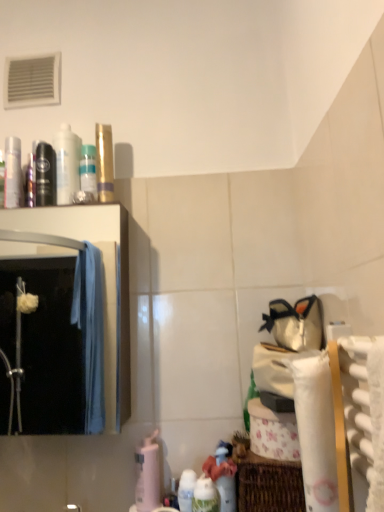
Question: Is white glossy bottle at lower center, the first cleaning product from the front, taller or shorter than white paper towel at lower right?

Choices:
 (A) short
 (B) tall

Answer: (A)

Question: From the image's perspective, is white glossy bottle at lower center, acting as the 1th cleaning product starting from the right, above or below white paper towel at lower right?

Choices:
 (A) below
 (B) above

Answer: (A)

Question: Based on their relative distances, which object is farther from the pink matte bottle at lower center, the third cleaning product when ordered from right to left?

Choices:
 (A) metallic silver mouthwash at left, placed as the fourth mouthwash when sorted from right to left
 (B) white glossy bottle at upper left, which appears as the second mouthwash when viewed from the right
 (C) white paper towel at lower right
 (D) translucent plastic bottle at upper center, which is counted as the fourth mouthwash, starting from the left
 (E) clear glass mirror at left

Answer: (E)

Question: Based on their relative distances, which object is nearer to the white glossy bottle at lower center, the first cleaning product from the front?

Choices:
 (A) metallic silver mouthwash at left, placed as the fourth mouthwash when sorted from right to left
 (B) white glossy bottle at lower center, which is the second cleaning product from back to front
 (C) woven brown basket at lower right
 (D) clear glass mirror at left
 (E) white textured bath towel at right

Answer: (B)